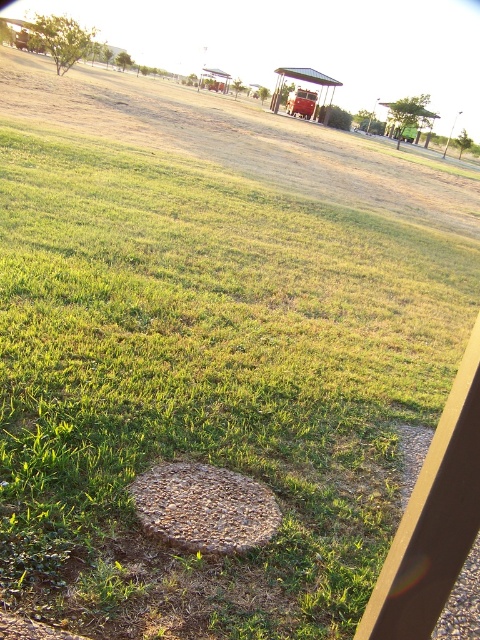
Question: Which of the following is the farthest from the observer?

Choices:
 (A) granular concrete manhole at center
 (B) metallic circular object at lower center

Answer: (A)

Question: Observing the image, what is the correct spatial positioning of granular concrete manhole at center in reference to metallic circular object at lower center?

Choices:
 (A) below
 (B) above

Answer: (A)

Question: Can you confirm if granular concrete manhole at center is wider than metallic circular object at lower center?

Choices:
 (A) no
 (B) yes

Answer: (B)

Question: Is granular concrete manhole at center above metallic circular object at lower center?

Choices:
 (A) yes
 (B) no

Answer: (B)